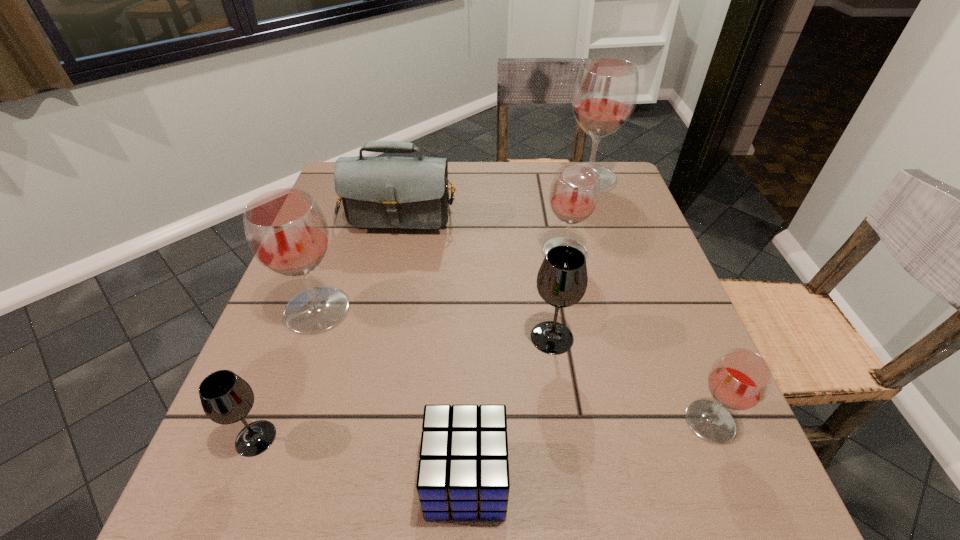
Locate an element on the screen. The height and width of the screenshot is (540, 960). the smaller gray wineglass is located at coordinates (226, 398).

Identify the location of the smallest red wineglass. The image size is (960, 540). (739, 380).

This screenshot has width=960, height=540. I want to click on red cube, so click(x=463, y=472).

Locate an element on the screen. This screenshot has height=540, width=960. the shortest object is located at coordinates (463, 472).

The image size is (960, 540). What are the coordinates of `free location located 0.320m on the front of the tallest wineglass` in the screenshot? It's located at (621, 274).

Where is `free space located 0.150m on the front of the second biggest red wineglass`? This screenshot has height=540, width=960. free space located 0.150m on the front of the second biggest red wineglass is located at coordinates (283, 406).

The height and width of the screenshot is (540, 960). Find the location of `free location located on the right of the shoulder bag`. free location located on the right of the shoulder bag is located at coordinates (503, 199).

The image size is (960, 540). Identify the location of free space located 0.310m on the back of the second farthest wineglass. (547, 171).

The width and height of the screenshot is (960, 540). Find the location of `vacant space located on the front of the farther gray wineglass`. vacant space located on the front of the farther gray wineglass is located at coordinates pyautogui.click(x=558, y=379).

The width and height of the screenshot is (960, 540). In order to click on free space located 0.050m on the right of the nearer gray wineglass in this screenshot , I will do `click(307, 438)`.